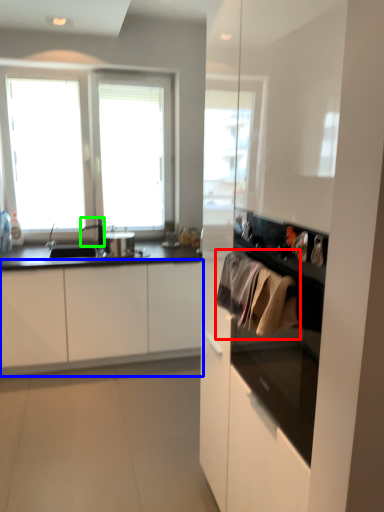
Question: Estimate the real-world distances between objects in this image. Which object is closer to laundry (highlighted by a red box), cabinetry (highlighted by a blue box) or faucet (highlighted by a green box)?

Choices:
 (A) cabinetry
 (B) faucet

Answer: (A)